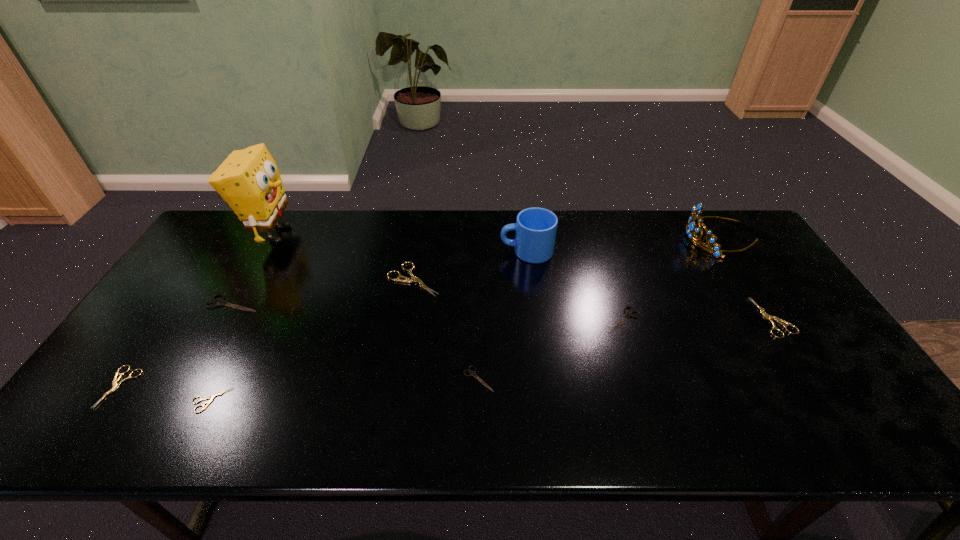
Where is `vacant space located 0.310m on the right of the shortest shears`? This screenshot has width=960, height=540. vacant space located 0.310m on the right of the shortest shears is located at coordinates (362, 400).

Image resolution: width=960 pixels, height=540 pixels. Identify the location of sponge positioned at the far edge. (248, 180).

The width and height of the screenshot is (960, 540). In order to click on tiara located at the far edge in this screenshot , I will do `click(691, 226)`.

Locate an element on the screen. mug situated at the far edge is located at coordinates (536, 228).

I want to click on sponge that is at the left edge, so tap(248, 180).

You are a GUI agent. You are given a task and a screenshot of the screen. Output one action in this format:
    pyautogui.click(x=<x>, y=<y>)
    Task: Click on the tiara present at the right edge
    This screenshot has width=960, height=540.
    Given the screenshot: What is the action you would take?
    pyautogui.click(x=691, y=226)

Where is `shears at the right edge`? The height and width of the screenshot is (540, 960). shears at the right edge is located at coordinates (770, 318).

Locate an element on the screen. This screenshot has width=960, height=540. object situated at the far left corner is located at coordinates (248, 180).

Identify the location of object that is at the near left corner. The height and width of the screenshot is (540, 960). (115, 385).

Identify the location of object that is at the far right corner. Image resolution: width=960 pixels, height=540 pixels. (691, 226).